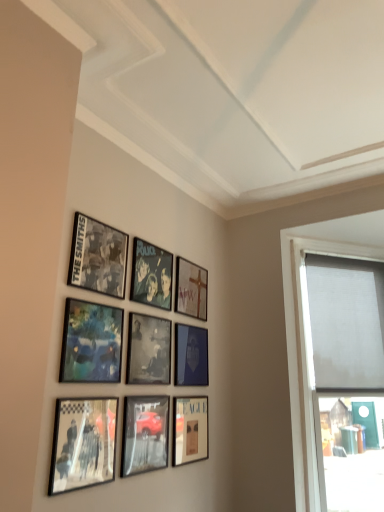
Question: Does metallic silver photo frame at center, which appears as the 8th picture frame when ordered from the bottom, appear on the right side of metallic reflective car at lower center, the 2th picture frame from the bottom?

Choices:
 (A) yes
 (B) no

Answer: (A)

Question: Does metallic silver photo frame at center, which appears as the second picture frame when viewed from the top, have a smaller size compared to metallic reflective car at lower center, acting as the 8th picture frame starting from the top?

Choices:
 (A) no
 (B) yes

Answer: (B)

Question: Is metallic silver photo frame at center, which appears as the 8th picture frame when ordered from the bottom, oriented away from metallic reflective car at lower center, the 2th picture frame from the bottom?

Choices:
 (A) no
 (B) yes

Answer: (A)

Question: Does metallic silver photo frame at center, which appears as the 8th picture frame when ordered from the bottom, have a greater height compared to metallic reflective car at lower center, the 2th picture frame from the bottom?

Choices:
 (A) yes
 (B) no

Answer: (A)

Question: Is metallic silver photo frame at center, which appears as the second picture frame when viewed from the top, positioned in front of metallic reflective car at lower center, the 2th picture frame from the bottom?

Choices:
 (A) yes
 (B) no

Answer: (B)

Question: From a real-world perspective, is matte black picture frame at lower center, positioned as the ninth picture frame in top-to-bottom order, physically located above or below metallic silver photo frame at center, which appears as the second picture frame when viewed from the top?

Choices:
 (A) above
 (B) below

Answer: (B)

Question: Is point (175, 410) positioned closer to the camera than point (153, 290)?

Choices:
 (A) farther
 (B) closer

Answer: (A)

Question: Visually, is matte black picture frame at lower center, positioned as the ninth picture frame in top-to-bottom order, positioned to the left or to the right of metallic silver photo frame at center, which appears as the 8th picture frame when ordered from the bottom?

Choices:
 (A) right
 (B) left

Answer: (A)

Question: Is matte black picture frame at lower center, marked as the first picture frame in a bottom-to-top arrangement, inside the boundaries of metallic silver photo frame at center, which appears as the 8th picture frame when ordered from the bottom, or outside?

Choices:
 (A) outside
 (B) inside

Answer: (A)

Question: Considering the positions of matte black picture frame at upper left, which ranks as the 9th picture frame in bottom-to-top order, and black matte picture frame at center, acting as the fifth picture frame starting from the top, in the image, is matte black picture frame at upper left, which ranks as the 9th picture frame in bottom-to-top order, bigger or smaller than black matte picture frame at center, acting as the fifth picture frame starting from the top,?

Choices:
 (A) big
 (B) small

Answer: (A)

Question: Considering the positions of point (122, 290) and point (152, 367), is point (122, 290) closer or farther from the camera than point (152, 367)?

Choices:
 (A) closer
 (B) farther

Answer: (A)

Question: From the image's perspective, is matte black picture frame at upper left, which ranks as the 9th picture frame in bottom-to-top order, located above or below black matte picture frame at center, the 5th picture frame from the bottom?

Choices:
 (A) below
 (B) above

Answer: (B)

Question: Considering the positions of matte black picture frame at upper left, which ranks as the 9th picture frame in bottom-to-top order, and black matte picture frame at center, acting as the fifth picture frame starting from the top, in the image, is matte black picture frame at upper left, which ranks as the 9th picture frame in bottom-to-top order, taller or shorter than black matte picture frame at center, acting as the fifth picture frame starting from the top,?

Choices:
 (A) tall
 (B) short

Answer: (B)

Question: Looking at the image, does matte black picture frame at lower center, marked as the first picture frame in a bottom-to-top arrangement, seem bigger or smaller compared to metallic reflective car at lower center, the 2th picture frame from the bottom?

Choices:
 (A) big
 (B) small

Answer: (A)

Question: Considering the positions of matte black picture frame at lower center, positioned as the ninth picture frame in top-to-bottom order, and metallic reflective car at lower center, acting as the 8th picture frame starting from the top, in the image, is matte black picture frame at lower center, positioned as the ninth picture frame in top-to-bottom order, wider or thinner than metallic reflective car at lower center, acting as the 8th picture frame starting from the top,?

Choices:
 (A) thin
 (B) wide

Answer: (B)